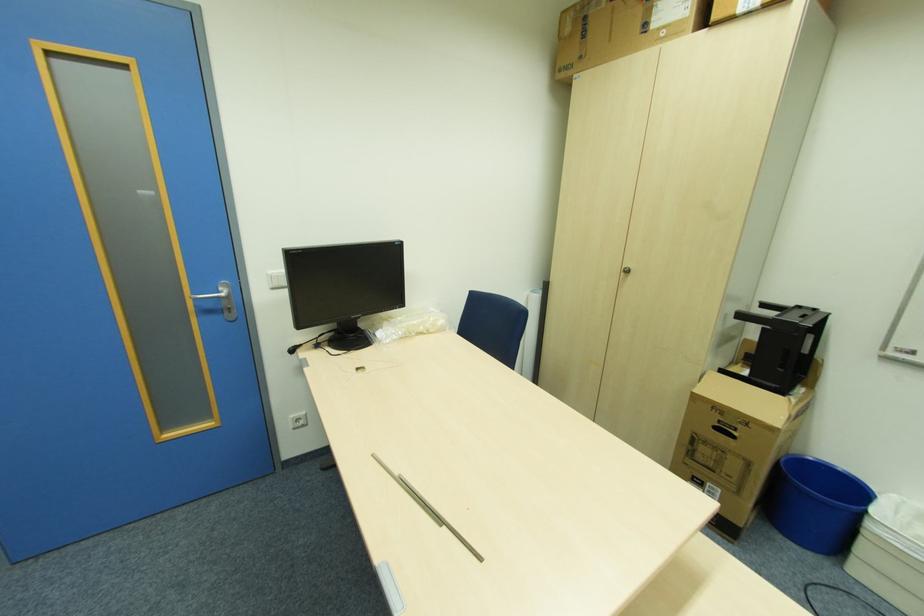
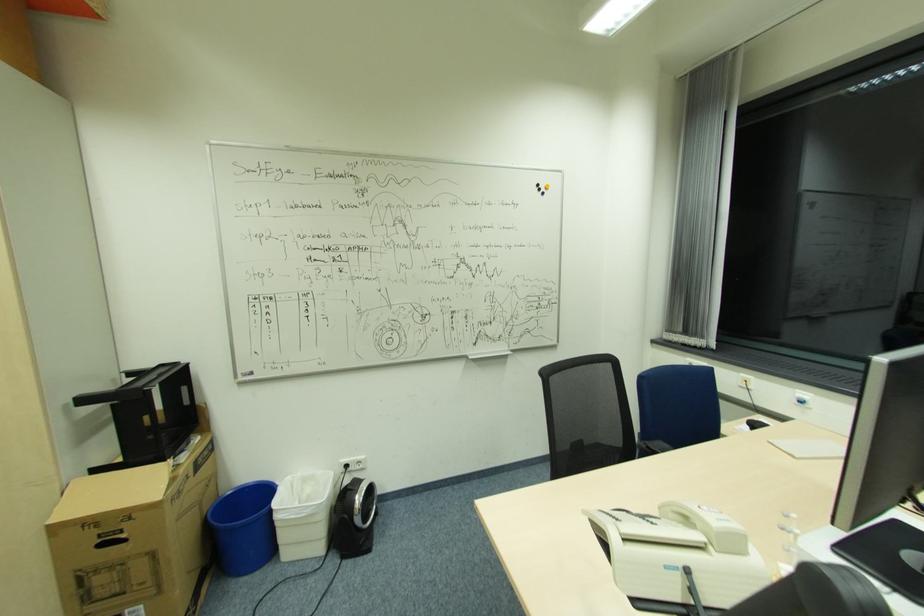
Locate, in the second image, the point that corresponds to point 698,391 in the first image.

(51, 522)